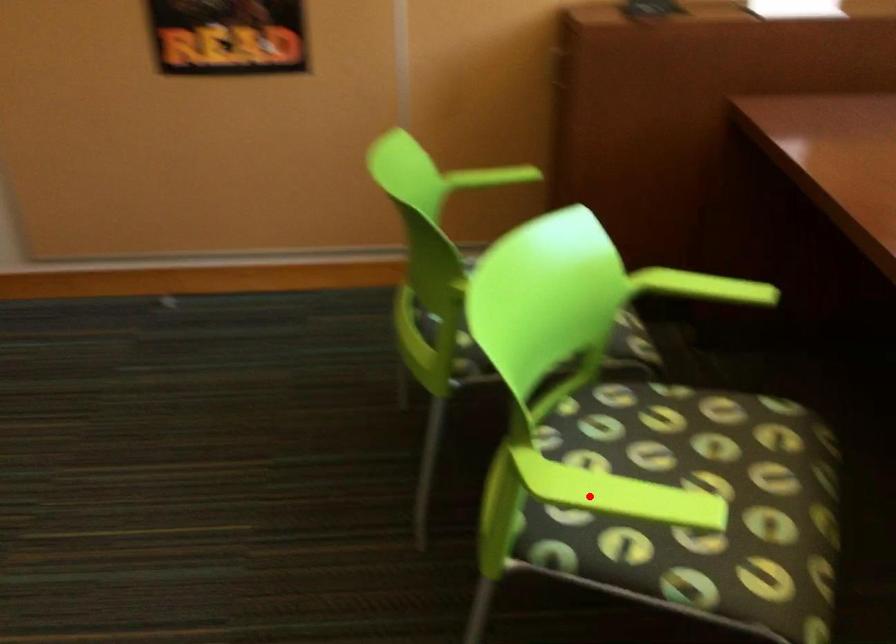
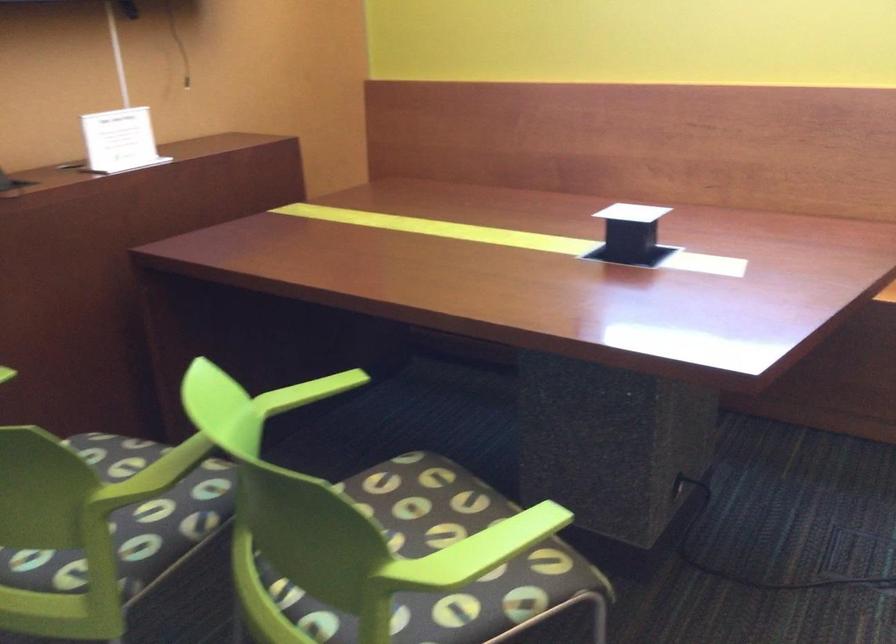
In the second image, find the point that corresponds to the highlighted location in the first image.

(476, 552)